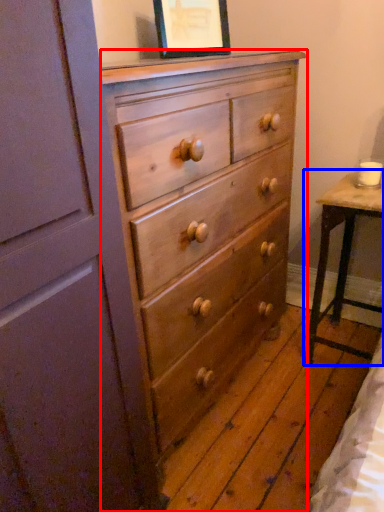
Question: Which of the following is the closest to the observer, chest of drawers (highlighted by a red box) or table (highlighted by a blue box)?

Choices:
 (A) chest of drawers
 (B) table

Answer: (A)